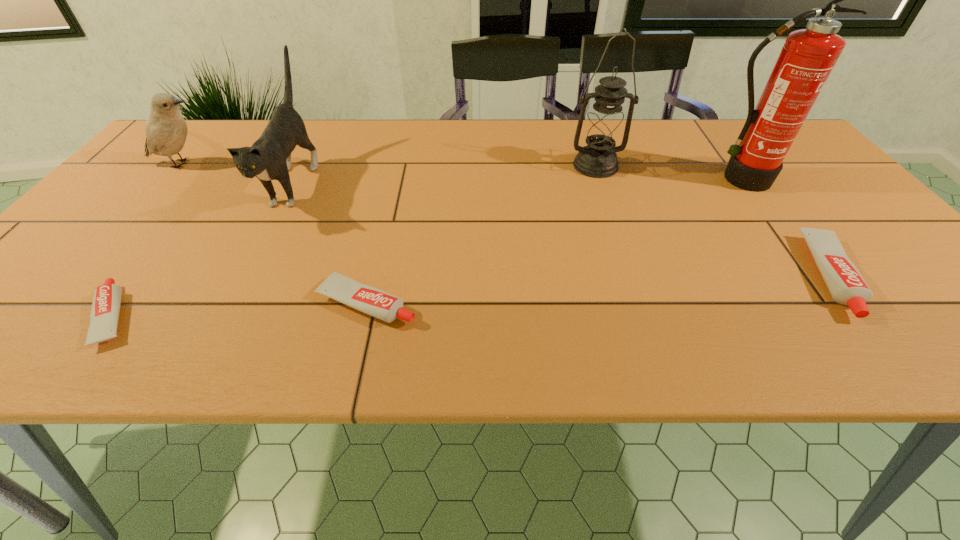
To make them evenly spaced by inserting another toothpaste among them, please locate a free space for this new toothpaste. Please provide its 2D coordinates. Your answer should be formatted as a tuple, i.e. [(x, y)], where the tuple contains the x and y coordinates of a point satisfying the conditions above.

[(607, 289)]